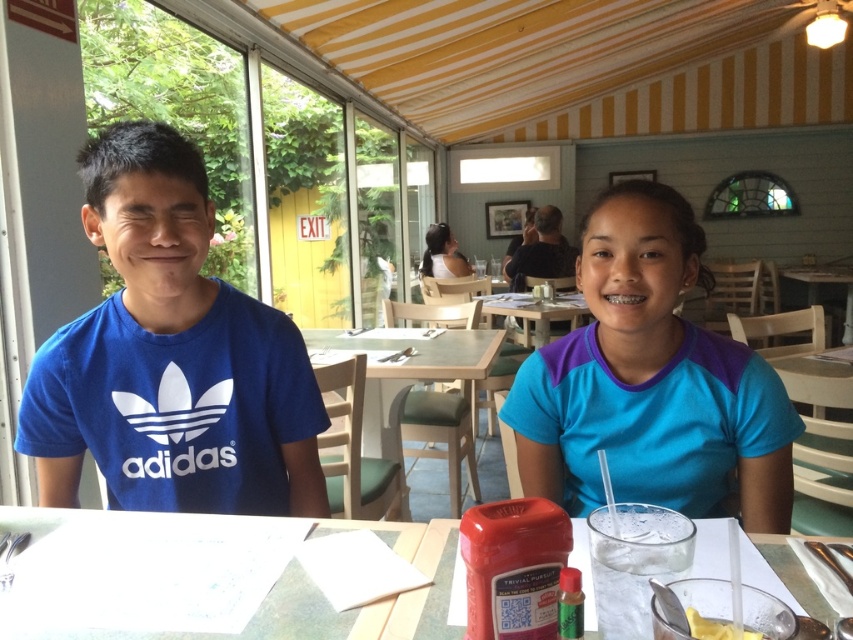
You are standing at the entrance of the dining area and want to walk straight to the clear glass table at center. According to the coordinates provided, what are the exact coordinates where you should aim to reach the table?

The clear glass table at center is located at coordinates point (325,600).